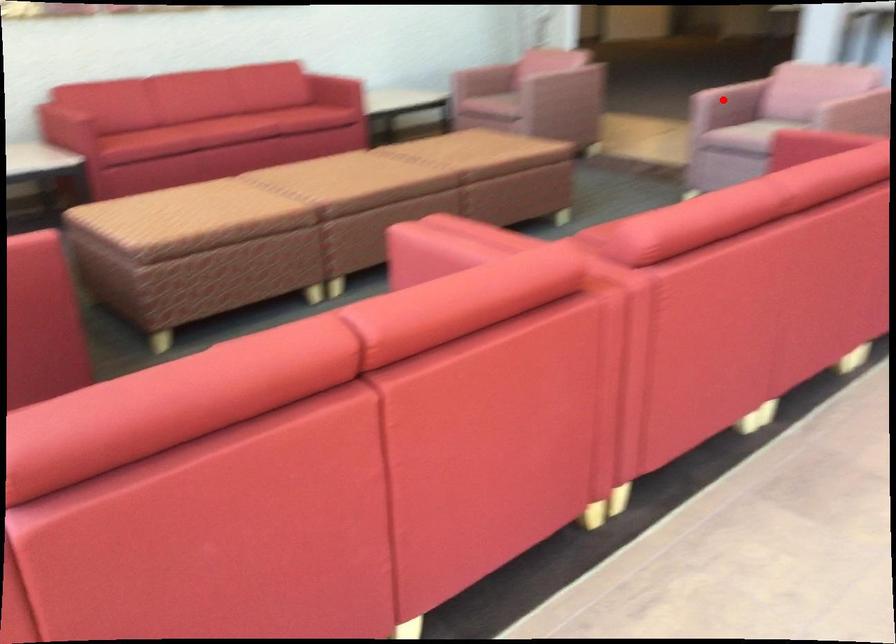
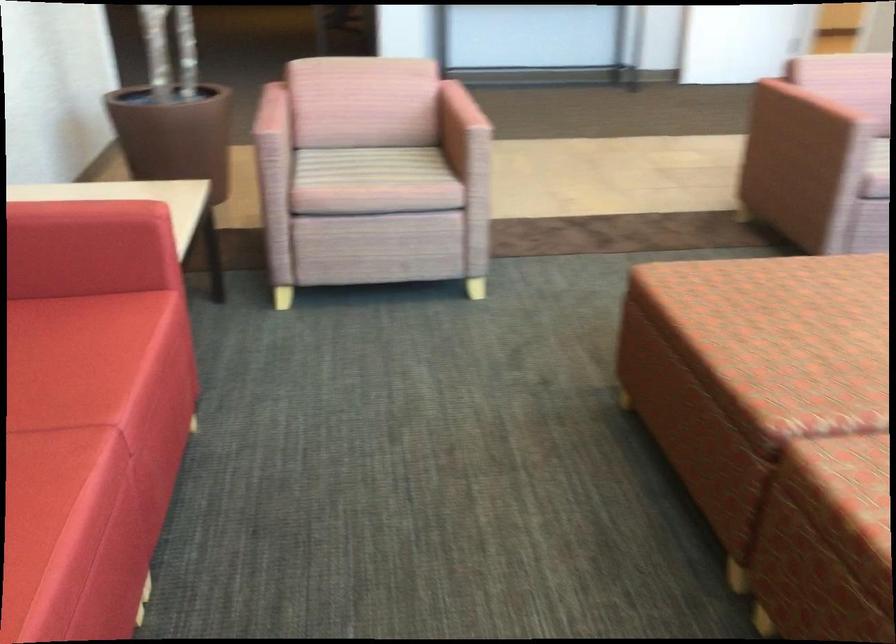
In the second image, find the point that corresponds to the highlighted location in the first image.

(810, 108)